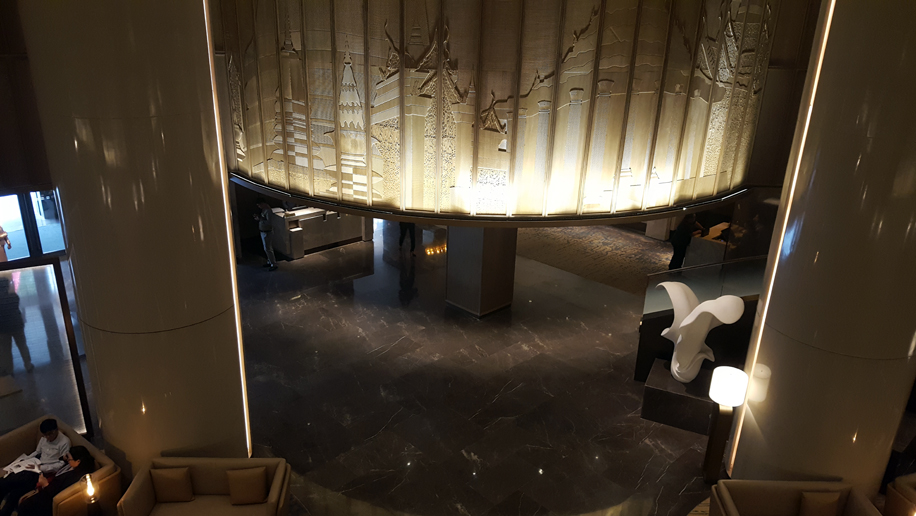
Locate an element on the screen. lamp is located at coordinates (738, 384).